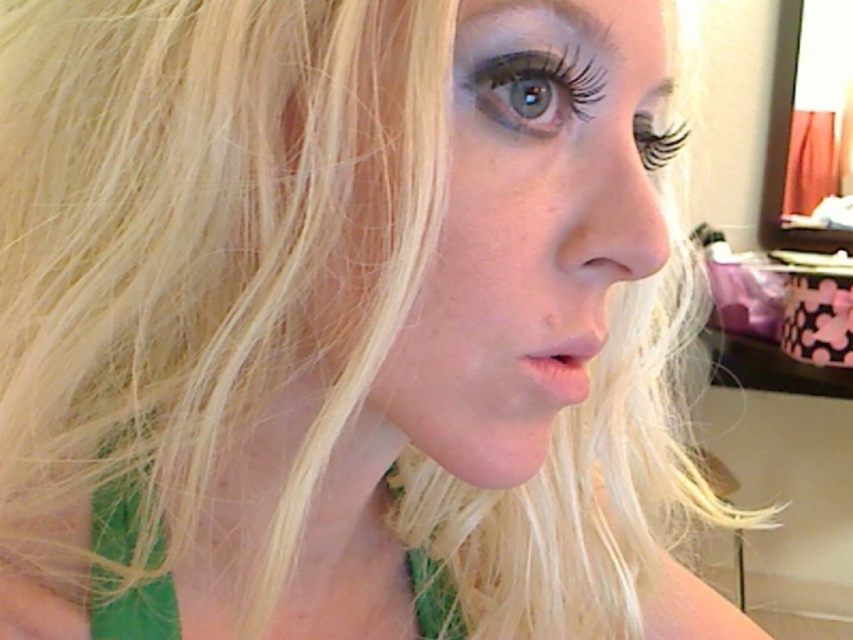
Question: Is dark brown hair at upper center bigger than green matte eye at upper center?

Choices:
 (A) yes
 (B) no

Answer: (A)

Question: Which of the following is the farthest from the observer?

Choices:
 (A) smooth skin face at center
 (B) black matte eyelashes at upper right
 (C) green matte eye at upper center

Answer: (B)

Question: Does dark brown hair at upper center have a smaller size compared to black matte eyelashes at upper right?

Choices:
 (A) yes
 (B) no

Answer: (A)

Question: Which of the following is the farthest from the observer?

Choices:
 (A) (662, 152)
 (B) (422, 372)

Answer: (A)

Question: Which object is positioned closest to the black matte eyelashes at upper right?

Choices:
 (A) green matte eye at upper center
 (B) smooth skin face at center

Answer: (B)

Question: Does smooth skin face at center lie in front of black matte eyelashes at upper right?

Choices:
 (A) yes
 (B) no

Answer: (A)